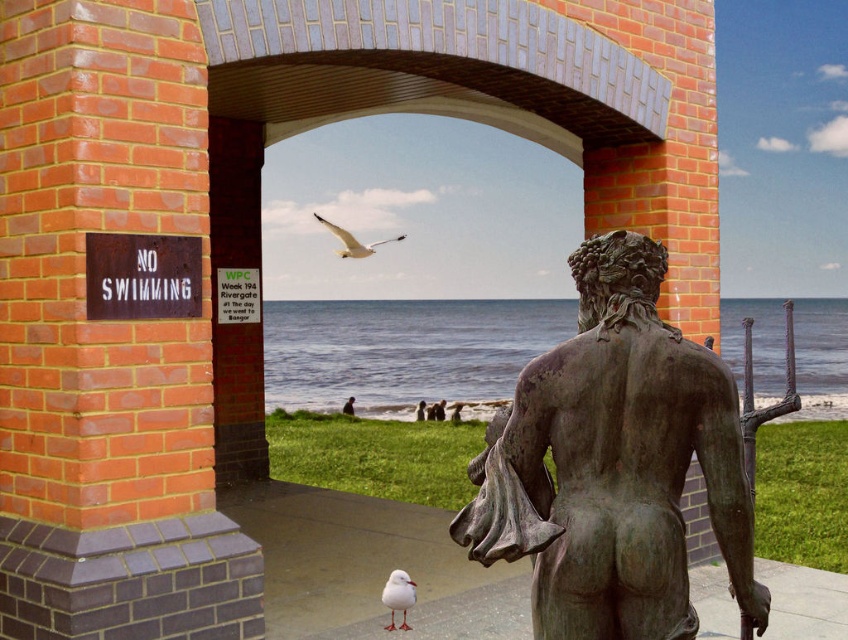
You are standing in front of the brick archway. You want to reach the blue water at center without touching the rusty metal sign at left. Is this possible based on their positions?

The rusty metal sign at left is behind the blue water at center, so you can reach the blue water at center without touching the rusty metal sign at left by moving around the sign or through the archway where the water is in front.

You are standing in front of the brick archway and want to find the blue water at center. Based on the coordinates provided, in which direction should you look relative to the archway?

The blue water at center is located at coordinates point (x=403, y=349), which means it is positioned slightly to the right and below the center of the image. Therefore, you should look slightly to the right and downward from the center of the archway to locate it.